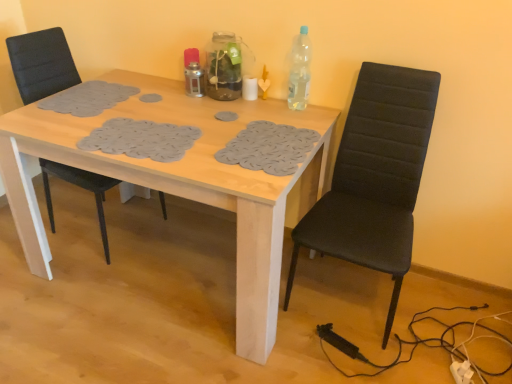
Locate an element on the screen. free space to the right of black fabric chair at right, the first chair from the right is located at coordinates (449, 318).